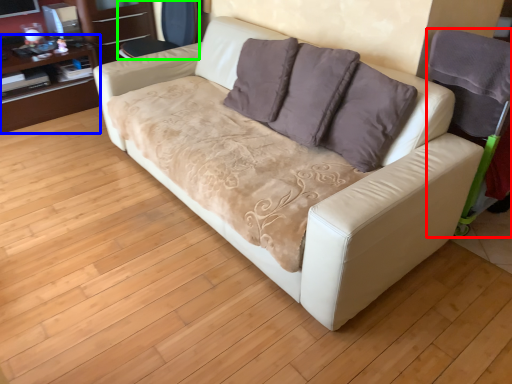
Question: Estimate the real-world distances between objects in this image. Which object is farther from armchair (highlighted by a red box), dresser (highlighted by a blue box) or armchair (highlighted by a green box)?

Choices:
 (A) dresser
 (B) armchair

Answer: (A)